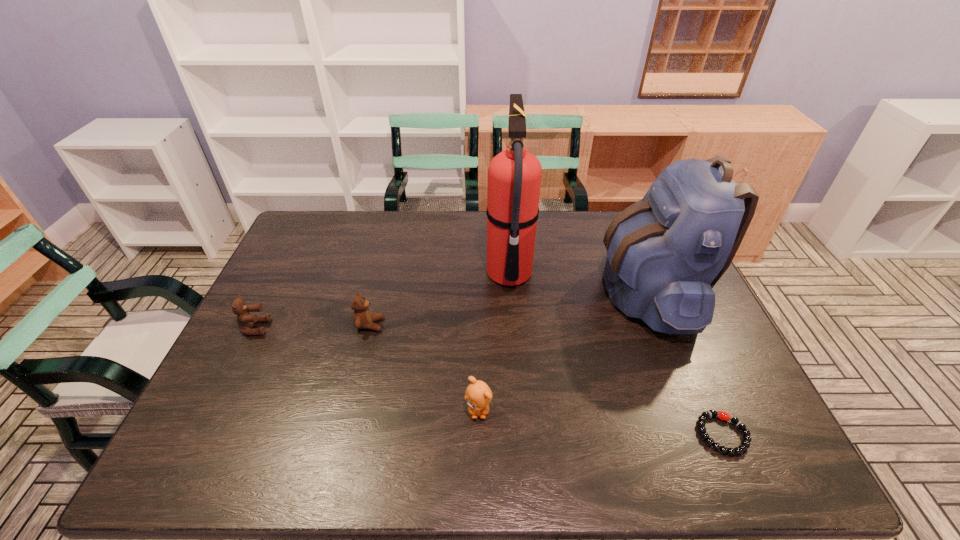
Find the location of a particular element. The width and height of the screenshot is (960, 540). blank space located 0.160m at the front pocket of the second tallest object is located at coordinates (547, 291).

The image size is (960, 540). In order to click on vacant space located at the front pocket of the second tallest object in this screenshot , I will do click(491, 291).

I want to click on vacant space located at the face of the fifth object from right to left, so click(519, 325).

Where is `vacant space located 0.400m on the face of the leftmost teddy bear`? vacant space located 0.400m on the face of the leftmost teddy bear is located at coordinates (412, 327).

Locate an element on the screen. The image size is (960, 540). blank space located on the face of the rightmost teddy bear is located at coordinates (478, 451).

Find the location of a particular element. This screenshot has width=960, height=540. blank space located 0.200m on the back of the shortest object is located at coordinates (684, 345).

Identify the location of object that is at the far edge. (665, 253).

This screenshot has height=540, width=960. I want to click on object positioned at the near edge, so click(x=724, y=416).

Find the location of a particular element. This screenshot has width=960, height=540. object present at the left edge is located at coordinates (245, 320).

Locate an element on the screen. backpack at the right edge is located at coordinates (665, 253).